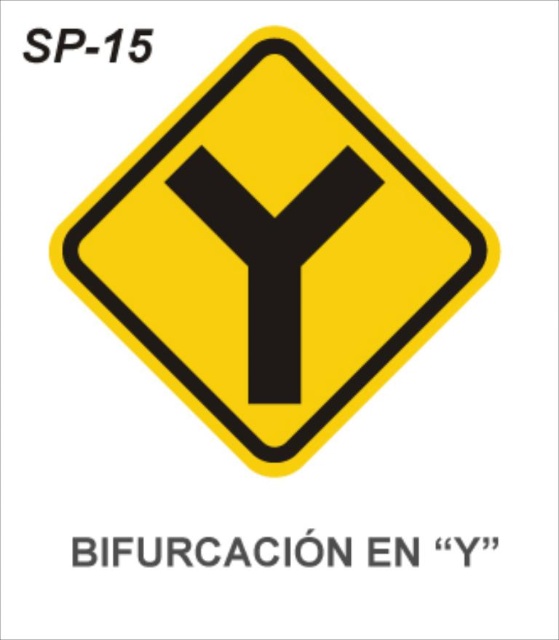
Between yellow matte diamond at center and black matte arrow at center, which one has less height?

black matte arrow at center

Does yellow matte diamond at center appear on the left side of black matte arrow at center?

In fact, yellow matte diamond at center is to the right of black matte arrow at center.

I want to click on yellow matte diamond at center, so click(x=273, y=250).